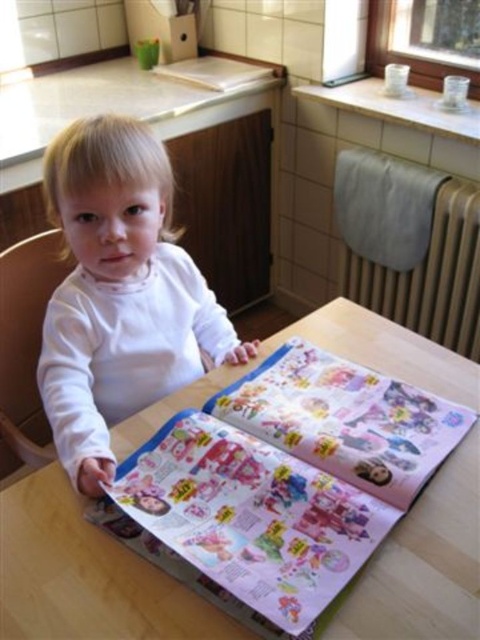
You are a caregiver in a daycare center. You see the white matte toddler at center and the wooden chair at left. Which object is closer to the camera?

The white matte toddler at center is closer to the camera because it is positioned over the wooden chair at left, indicating it is in front of the chair.

You are a parent who wants to adjust the seating arrangement for your child to read comfortably. Considering the wooden table at center and the wooden chair at left, which furniture item should you lower to improve the child seating height?

The wooden table at center has a lesser height compared to wooden chair at left, so you should lower the wooden chair at left to match the height of the wooden table at center for proper seating posture.